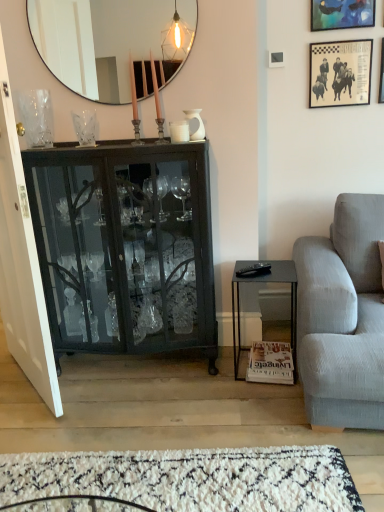
This screenshot has height=512, width=384. Find the location of `vacant area that lies between black metal side table at lower right and black glass cabinet at left`. vacant area that lies between black metal side table at lower right and black glass cabinet at left is located at coordinates (211, 368).